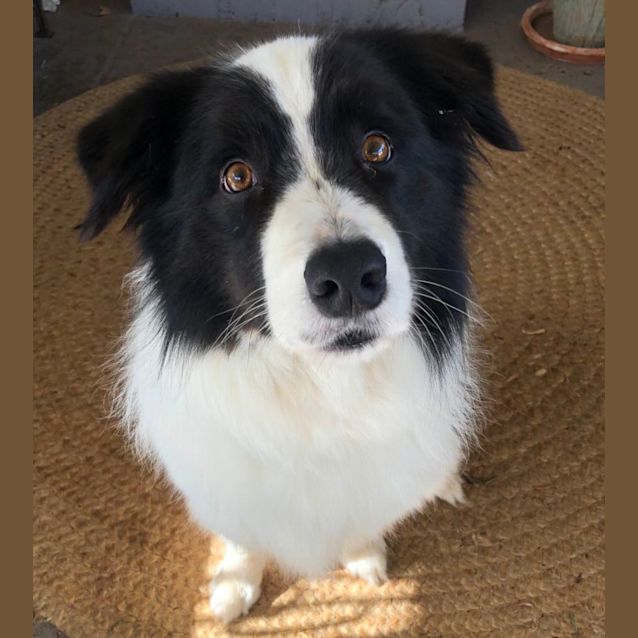
At what (x,y) coordinates should I click in order to perform the action: click on brown jute rug. Please return your answer as a coordinate pair (x, y). Looking at the image, I should click on click(x=540, y=279).